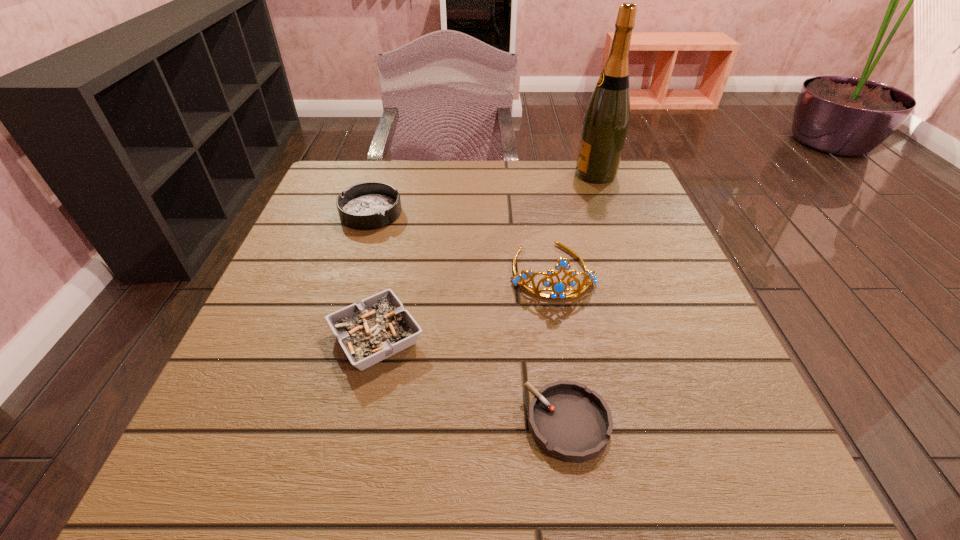
Find the location of a particular element. the rightmost object is located at coordinates (606, 120).

What are the coordinates of `the farthest object` in the screenshot? It's located at pyautogui.click(x=606, y=120).

Find the location of a particular element. This screenshot has height=540, width=960. the second tallest object is located at coordinates (559, 287).

This screenshot has width=960, height=540. Identify the location of the farthest ashtray. (371, 205).

Find the location of a particular element. This screenshot has height=540, width=960. the second nearest ashtray is located at coordinates (378, 327).

What are the coordinates of `the nearest object` in the screenshot? It's located at (568, 421).

This screenshot has width=960, height=540. What are the coordinates of `the rightmost ashtray` in the screenshot? It's located at (568, 421).

At what (x,y) coordinates should I click in order to perform the action: click on free point located on the front-facing side of the rightmost object. Please return your answer as a coordinate pair (x, y). This screenshot has width=960, height=540. Looking at the image, I should click on coord(494,174).

This screenshot has width=960, height=540. What are the coordinates of `vacant space positioned on the front-facing side of the rightmost object` in the screenshot? It's located at (463, 174).

Identify the location of free space located 0.050m on the front-facing side of the rightmost object. The image size is (960, 540). (556, 174).